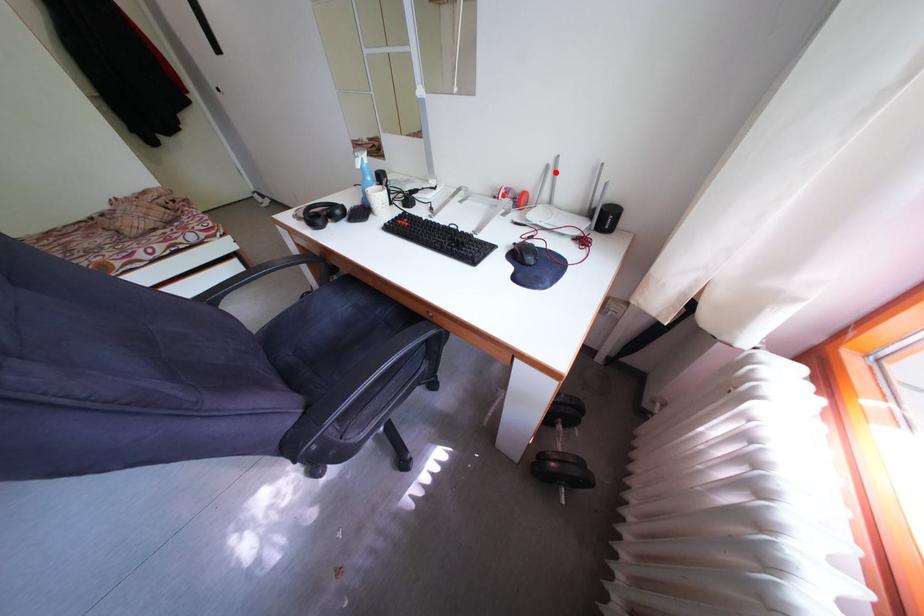
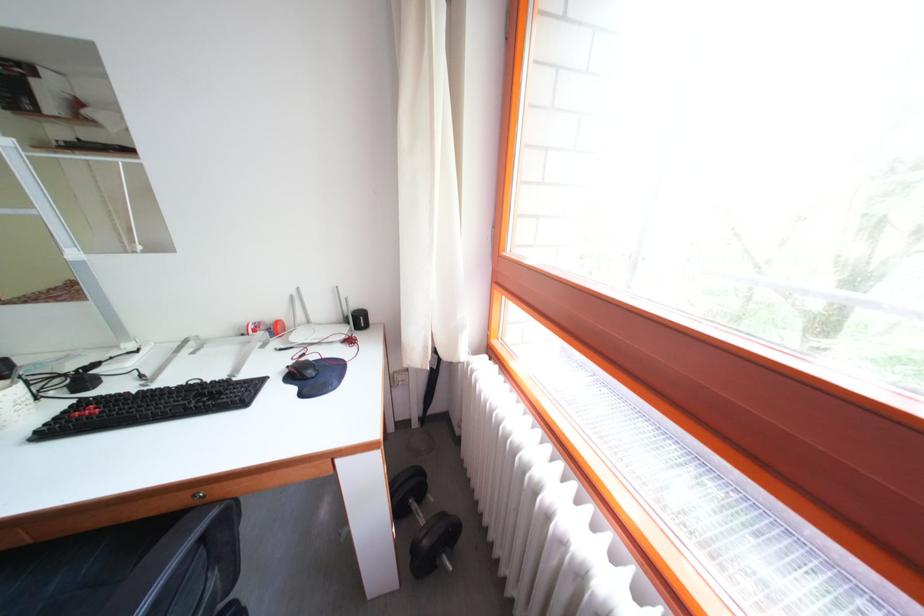
In the second image, find the point that corresponds to the highlighted location in the first image.

(300, 302)